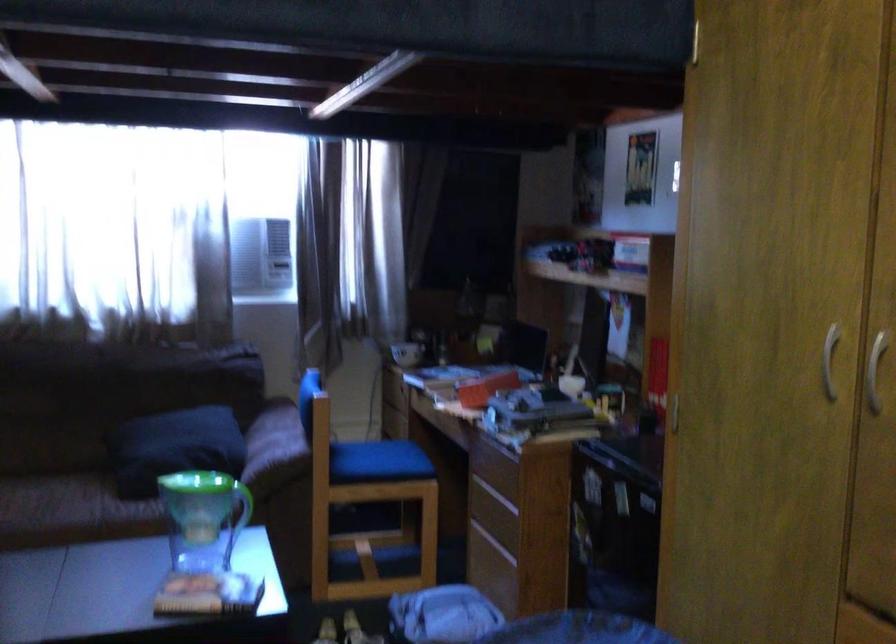
Where would you lift the green cup handle? Please return your answer as a coordinate pair (x, y).

(240, 509)